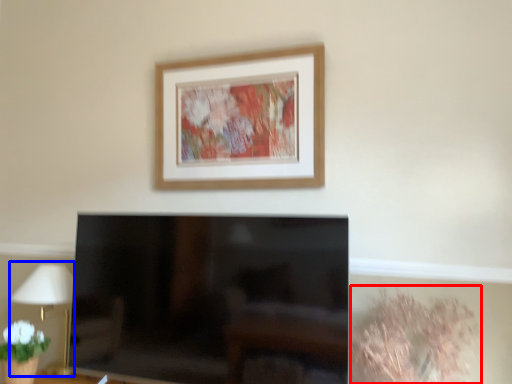
Question: Among these objects, which one is farthest to the camera, plant (highlighted by a red box) or table lamp (highlighted by a blue box)?

Choices:
 (A) plant
 (B) table lamp

Answer: (B)